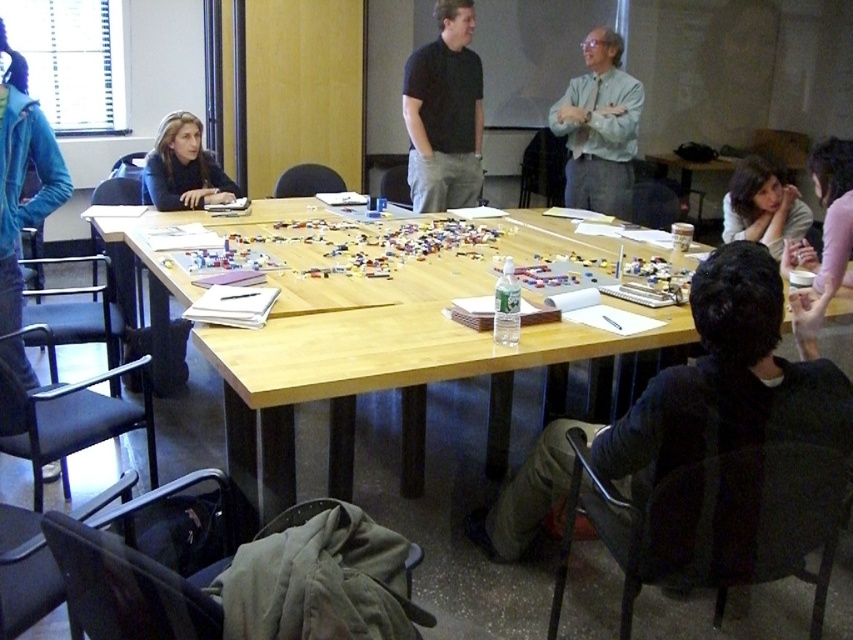
You are a photographer trying to capture a candid shot of the light blue shirt at center and the light brown hair at lower right. Based on their positions, which object is closer to the camera?

The light blue shirt at center is closer to the camera because it is positioned above the light brown hair at lower right, indicating it is in a higher plane and thus nearer to the viewer.

You are a photographer setting up for a group photo. You need to arrange the two jackets, dark gray fabric jacket at lower right and matte black jacket at upper left, so that both are visible in the frame. Considering their sizes, which jacket should you place closer to the camera to ensure both are fully visible?

The dark gray fabric jacket at lower right is taller than the matte black jacket at upper left. To ensure both are fully visible in the frame, place the matte black jacket at upper left closer to the camera so that its smaller size doesn